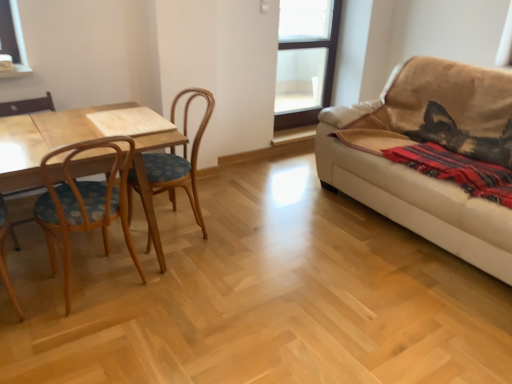
I want to click on free space between wooden table at left and beige fabric couch at right, so click(298, 253).